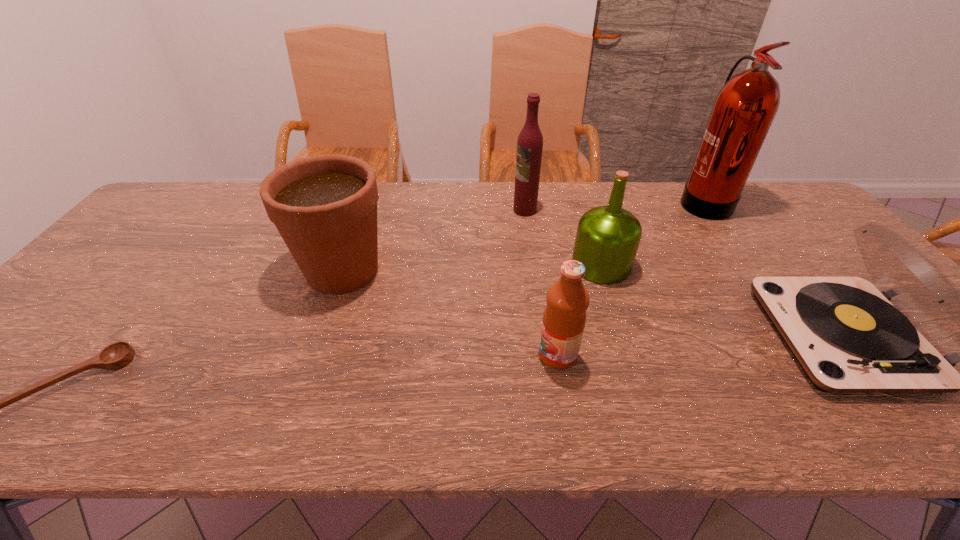
This screenshot has height=540, width=960. In order to click on vacant space situated 0.080m on the label of the second tallest object in this screenshot , I will do tap(489, 210).

Find the location of `vacant space positioned 0.290m on the left of the olive oil`. vacant space positioned 0.290m on the left of the olive oil is located at coordinates (467, 265).

The width and height of the screenshot is (960, 540). What are the coordinates of `blank area located 0.170m on the front of the sixth object from right to left` in the screenshot? It's located at click(x=311, y=359).

You are a GUI agent. You are given a task and a screenshot of the screen. Output one action in this format:
    pyautogui.click(x=<x>, y=<y>)
    Task: Click on the free space located on the front label of the fruit juice
    This screenshot has width=960, height=540.
    Given the screenshot: What is the action you would take?
    pyautogui.click(x=498, y=355)

Where is `vacant area located 0.260m on the front label of the fruit juice`? Image resolution: width=960 pixels, height=540 pixels. vacant area located 0.260m on the front label of the fruit juice is located at coordinates (422, 355).

Locate an element on the screen. This screenshot has height=540, width=960. vacant space situated on the front label of the fruit juice is located at coordinates (404, 355).

Locate an element on the screen. The height and width of the screenshot is (540, 960). fire extinguisher located in the far edge section of the desktop is located at coordinates (744, 109).

At what (x,y) coordinates should I click in order to perform the action: click on liquor located in the far edge section of the desktop. Please return your answer as a coordinate pair (x, y). The height and width of the screenshot is (540, 960). Looking at the image, I should click on (530, 140).

Image resolution: width=960 pixels, height=540 pixels. In the image, there is a desktop. What are the coordinates of `vacant space at the far edge` in the screenshot? It's located at (656, 214).

Image resolution: width=960 pixels, height=540 pixels. In order to click on vacant area at the near edge in this screenshot , I will do `click(618, 396)`.